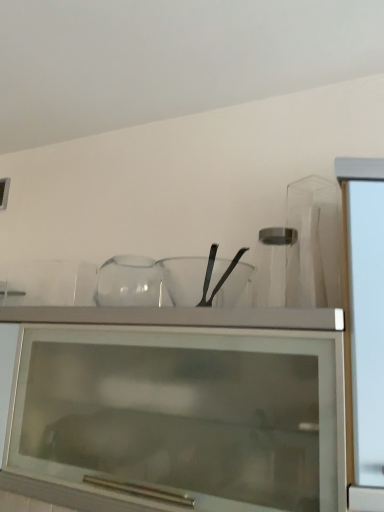
Describe the element at coordinates (271, 266) in the screenshot. I see `transparent glass jar at center` at that location.

This screenshot has width=384, height=512. In order to click on transparent glass jar at center in this screenshot , I will do `click(271, 266)`.

Identify the location of transparent glass cabinet at upper center. (183, 401).

Where is `transparent glass jar at center`? transparent glass jar at center is located at coordinates (271, 266).

From the picture: Who is taller, transparent glass jar at center or transparent glass cabinet at upper center?

transparent glass cabinet at upper center.

From a real-world perspective, is transparent glass jar at center physically above transparent glass cabinet at upper center?

Yes, from a real-world perspective, transparent glass jar at center is over transparent glass cabinet at upper center

Considering the relative positions of transparent glass jar at center and transparent glass cabinet at upper center in the image provided, is transparent glass jar at center to the right of transparent glass cabinet at upper center from the viewer's perspective?

Indeed, transparent glass jar at center is positioned on the right side of transparent glass cabinet at upper center.

Considering their positions, is transparent glass cabinet at upper center located in front of or behind transparent glass jar at center?

Clearly, transparent glass cabinet at upper center is in front of transparent glass jar at center.

Is transparent glass jar at center completely or partially inside transparent glass cabinet at upper center?

That's incorrect, transparent glass jar at center is not inside transparent glass cabinet at upper center.

Can you confirm if transparent glass cabinet at upper center is positioned to the left of transparent glass jar at center?

Indeed, transparent glass cabinet at upper center is positioned on the left side of transparent glass jar at center.

From the image's perspective, would you say transparent glass cabinet at upper center is positioned over transparent glass jar at center?

No.

Based on the photo, is transparent glass jar at center taller or shorter than transparent glass mixing bowl at center?

transparent glass jar at center is taller than transparent glass mixing bowl at center.

Is transparent glass jar at center positioned far away from transparent glass mixing bowl at center?

Actually, transparent glass jar at center and transparent glass mixing bowl at center are a little close together.

Is transparent glass jar at center oriented away from transparent glass mixing bowl at center?

That's not correct — transparent glass jar at center is not looking away from transparent glass mixing bowl at center.

From a real-world perspective, which object rests below the other?

In real-world perspective, transparent glass mixing bowl at center is lower.

Which object is thinner, transparent glass mixing bowl at center or transparent glass jar at center?

Thinner between the two is transparent glass jar at center.

Considering the sizes of transparent glass mixing bowl at center and transparent glass jar at center in the image, is transparent glass mixing bowl at center taller or shorter than transparent glass jar at center?

transparent glass mixing bowl at center is shorter than transparent glass jar at center.

Considering the relative sizes of transparent glass mixing bowl at center and transparent glass jar at center in the image provided, is transparent glass mixing bowl at center bigger than transparent glass jar at center?

Yes.

At what (x,y) coordinates should I click in order to perform the action: click on cabinetry located underneath the transparent glass mixing bowl at center (from a real-world perspective). Please return your answer as a coordinate pair (x, y). Image resolution: width=384 pixels, height=512 pixels. Looking at the image, I should click on (183, 401).

Considering the positions of objects transparent glass mixing bowl at center and transparent glass cabinet at upper center in the image provided, who is more to the right, transparent glass mixing bowl at center or transparent glass cabinet at upper center?

From the viewer's perspective, transparent glass mixing bowl at center appears more on the right side.

In the scene shown: Is transparent glass mixing bowl at center taller or shorter than transparent glass cabinet at upper center?

Considering their sizes, transparent glass mixing bowl at center has less height than transparent glass cabinet at upper center.

Would you say transparent glass mixing bowl at center is outside transparent glass cabinet at upper center?

transparent glass mixing bowl at center lies outside transparent glass cabinet at upper center's area.

Is transparent glass cabinet at upper center positioned with its back to transparent glass mixing bowl at center?

transparent glass cabinet at upper center is not turned away from transparent glass mixing bowl at center.

How many degrees apart are the facing directions of transparent glass cabinet at upper center and transparent glass mixing bowl at center?

The angular difference between transparent glass cabinet at upper center and transparent glass mixing bowl at center is 0.122 degrees.

From the image's perspective, between transparent glass cabinet at upper center and transparent glass mixing bowl at center, who is located below?

From the image's view, transparent glass cabinet at upper center is below.

Is transparent glass mixing bowl at center located within transparent glass cabinet at upper center?

No.

This screenshot has height=512, width=384. I want to click on glass vase behind the transparent glass cabinet at upper center, so click(271, 266).

Find the location of a particular element. cabinetry in front of the transparent glass jar at center is located at coordinates (183, 401).

When comparing their distances from transparent glass mixing bowl at center, does transparent glass jar at center or transparent glass cabinet at upper center seem further?

transparent glass cabinet at upper center is positioned further to the anchor transparent glass mixing bowl at center.

Which object lies further to the anchor point transparent glass cabinet at upper center, transparent glass jar at center or transparent glass mixing bowl at center?

transparent glass jar at center.

Which object lies nearer to the anchor point transparent glass mixing bowl at center, transparent glass cabinet at upper center or transparent glass jar at center?

transparent glass jar at center is closer to transparent glass mixing bowl at center.

From the picture: Estimate the real-world distances between objects in this image. Which object is further from transparent glass jar at center, transparent glass mixing bowl at center or transparent glass cabinet at upper center?

The object further to transparent glass jar at center is transparent glass cabinet at upper center.

Consider the image. When comparing their distances from transparent glass cabinet at upper center, does transparent glass mixing bowl at center or transparent glass jar at center seem closer?

transparent glass mixing bowl at center.

Estimate the real-world distances between objects in this image. Which object is further from transparent glass jar at center, transparent glass cabinet at upper center or transparent glass mixing bowl at center?

transparent glass cabinet at upper center is positioned further to the anchor transparent glass jar at center.

Where is `mixing bowl between transparent glass cabinet at upper center and transparent glass jar at center`? This screenshot has height=512, width=384. mixing bowl between transparent glass cabinet at upper center and transparent glass jar at center is located at coordinates (204, 280).